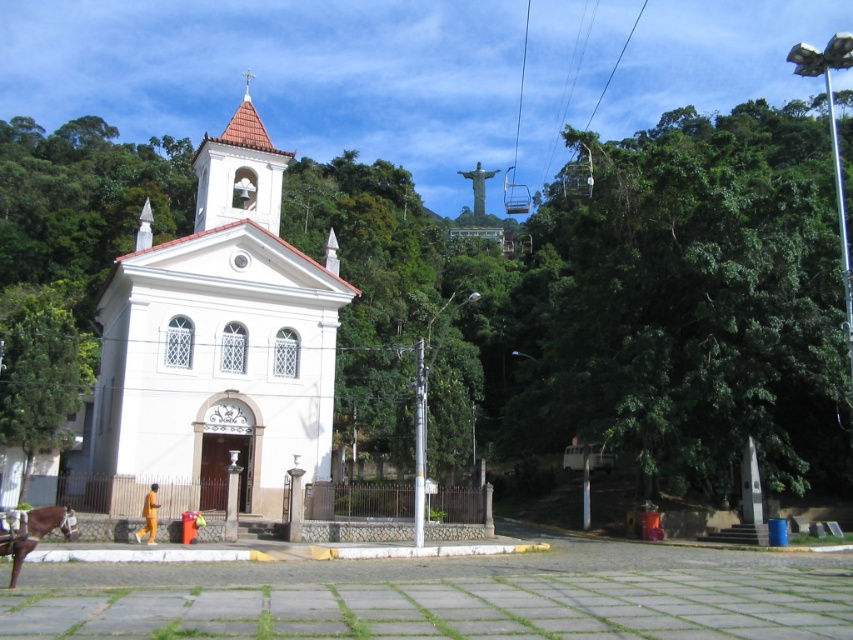
You are standing at the entrance of the white church with a red tiled roof and looking towards the cable car system. Which object is positioned to the right of the other between the green leafy tree at upper right and the brown glossy horse at lower left?

The green leafy tree at upper right is positioned to the right of the brown glossy horse at lower left.

In the scene shown: You are a photographer standing at the camera position in the scene. You want to capture a photo of the green leafy tree at upper right. However, your camera has a maximum focus range of 40 meters. Will you be able to focus on the tree?

The green leafy tree at upper right is 41.27 meters away from camera, which exceeds the camera maximum focus range of 40 meters. Therefore, you cannot focus on the tree.

You are a tourist standing at the entrance of the white matte church at center and want to take a photo of the brown glossy horse at lower left. Which direction should you face to capture both the church and the horse in the same frame?

The white matte church at center is positioned on the left side of the brown glossy horse at lower left, so you should face to the left to include both the church and the horse in your photo.